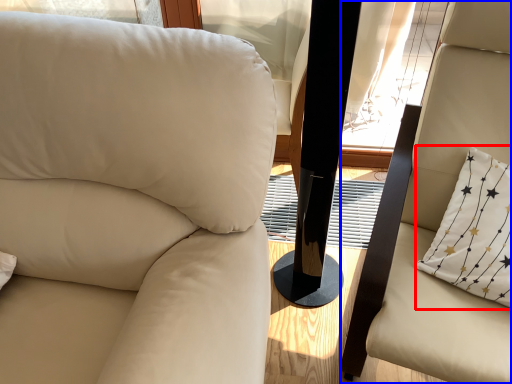
Question: Which of the following is the farthest to the observer, pillow (highlighted by a red box) or chair (highlighted by a blue box)?

Choices:
 (A) pillow
 (B) chair

Answer: (A)